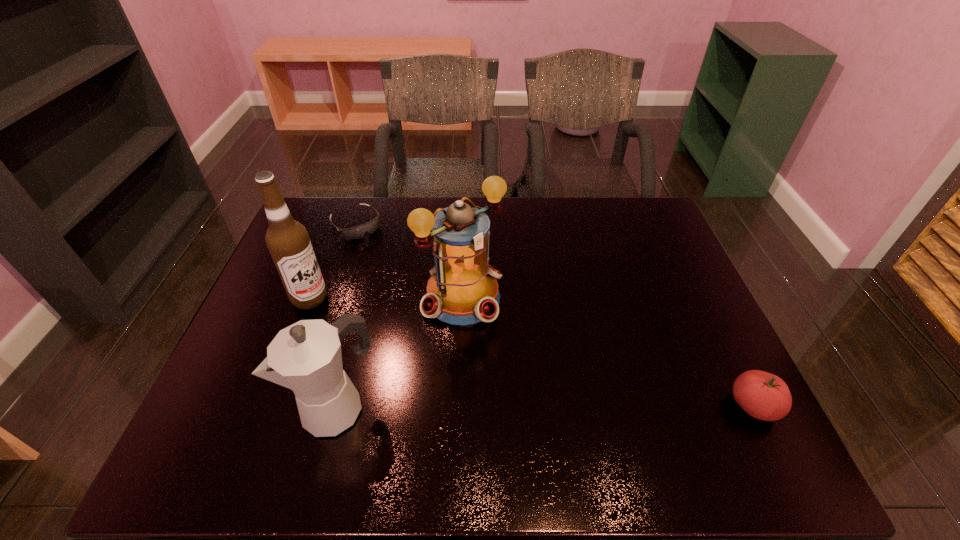
Locate an element on the screen. The height and width of the screenshot is (540, 960). free location located 0.120m on the label of the alcohol is located at coordinates (356, 323).

Locate an element on the screen. The image size is (960, 540). free space located 0.180m on the label of the alcohol is located at coordinates (374, 332).

Find the location of `vacant point located on the label of the alcohol`. vacant point located on the label of the alcohol is located at coordinates (377, 334).

Find the location of `free space located 0.300m on the front-facing side of the second tallest object`. free space located 0.300m on the front-facing side of the second tallest object is located at coordinates click(574, 400).

You are a GUI agent. You are given a task and a screenshot of the screen. Output one action in this format:
    pyautogui.click(x=<x>, y=<y>)
    Task: Click on the vacant area situated on the front-facing side of the second tallest object
    This screenshot has width=960, height=540.
    Given the screenshot: What is the action you would take?
    pyautogui.click(x=525, y=354)

Locate an element on the screen. Image resolution: width=960 pixels, height=540 pixels. vacant region located 0.150m on the front-facing side of the second tallest object is located at coordinates (528, 357).

Find the location of a particular element. free space located 0.400m on the lenses of the shortest object is located at coordinates (436, 313).

I want to click on free space located 0.220m on the lenses of the shortest object, so click(402, 276).

The height and width of the screenshot is (540, 960). What are the coordinates of `vacant space located on the lenses of the shortest object` in the screenshot? It's located at (378, 249).

Locate an element on the screen. object that is positioned at the far edge is located at coordinates (357, 232).